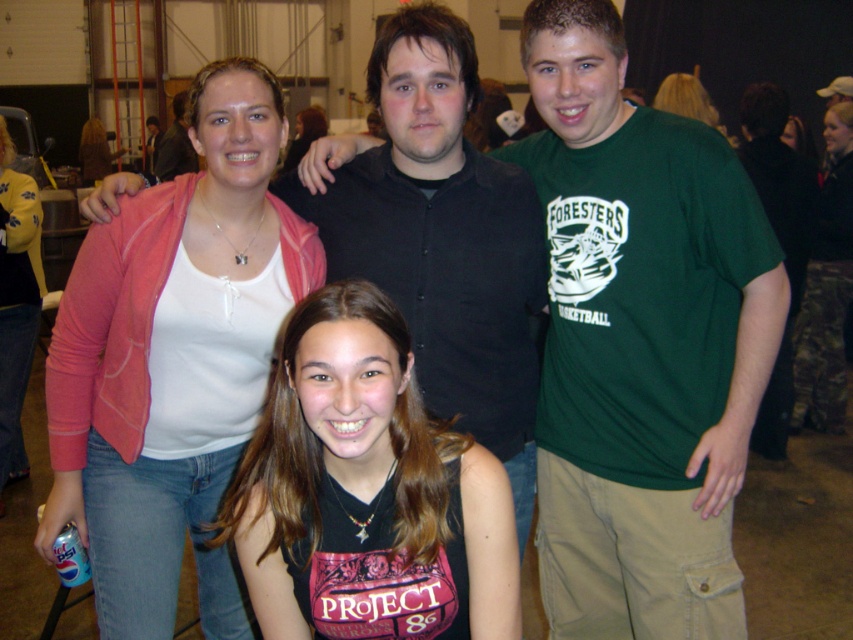
You are a photographer trying to capture a clear shot of the matte yellow jacket at upper left and the blonde hair at upper center. Since you can only focus on one subject at a time, which one should you focus on to ensure it appears sharp in the photo?

The matte yellow jacket at upper left is in front of the blonde hair at upper center, so focusing on the matte yellow jacket at upper left will ensure it appears sharp while the background subject may be slightly blurred.

You are a photographer setting up a photo shoot in an indoor warehouse space. You have two key pieces of equipment to position near the group of people in the image. One is a large light panel that needs to be placed 2 meters away from the matte yellow jacket at upper left. The other is a microphone stand that must be positioned exactly 1.5 meters away from the black shirt at upper center. Given the current arrangement, is it possible to place both the light panel and the microphone stand at their required

The distance between the black shirt at upper center and the matte yellow jacket at upper left is 2.06 meters. Since the light panel needs to be 2 meters from the matte yellow jacket and the microphone stand must be 1.5 meters from the black shirt, the two equipment placements are feasible as the existing distance allows for both requirements without overlap. However, precise positioning would depend on the exact angles and available space around the group.